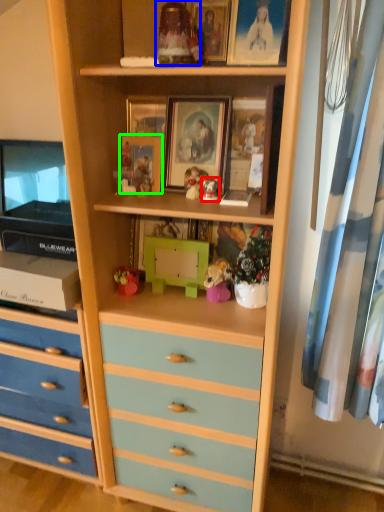
Question: Which object is positioned farthest from toy (highlighted by a red box)? Select from toy (highlighted by a blue box) and picture frame (highlighted by a green box).

Choices:
 (A) toy
 (B) picture frame

Answer: (A)